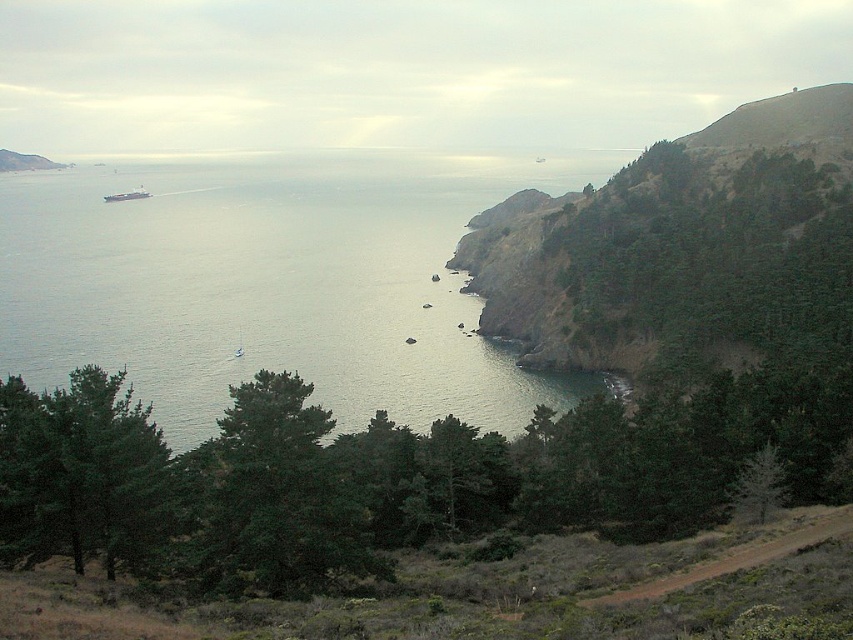
Looking at this image, you are standing at the edge of the cliff looking out at the coastal landscape. You notice two points marked in the scene. Which point, point (381, 529) or point (253, 204), is closer to you?

Point (381, 529) is closer to the viewer than point (253, 204).

You are standing on the cliff overlooking the coast and see the clear water at center and the metallic gray ship at left. Which object is positioned lower in the scene?

The clear water at center is positioned lower than the metallic gray ship at left because it is located below it.

You are a photographer standing on the cliff edge, wanting to capture the metallic gray ship at left and the clear water at center in your shot. Which object should you focus on first if you want to include both in your frame?

You should focus on the metallic gray ship at left first because it is closer to you than the clear water at center, so you can adjust your framing to include both.